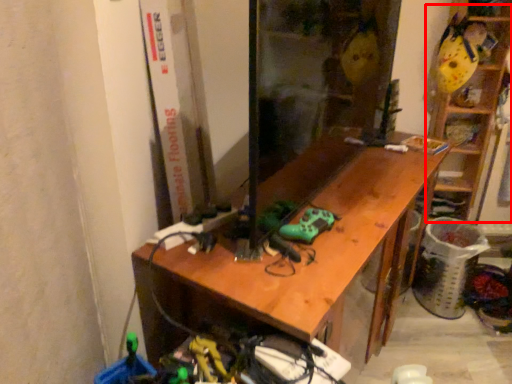
Question: Where is shelf (annotated by the red box) located in relation to desk in the image?

Choices:
 (A) left
 (B) right

Answer: (B)